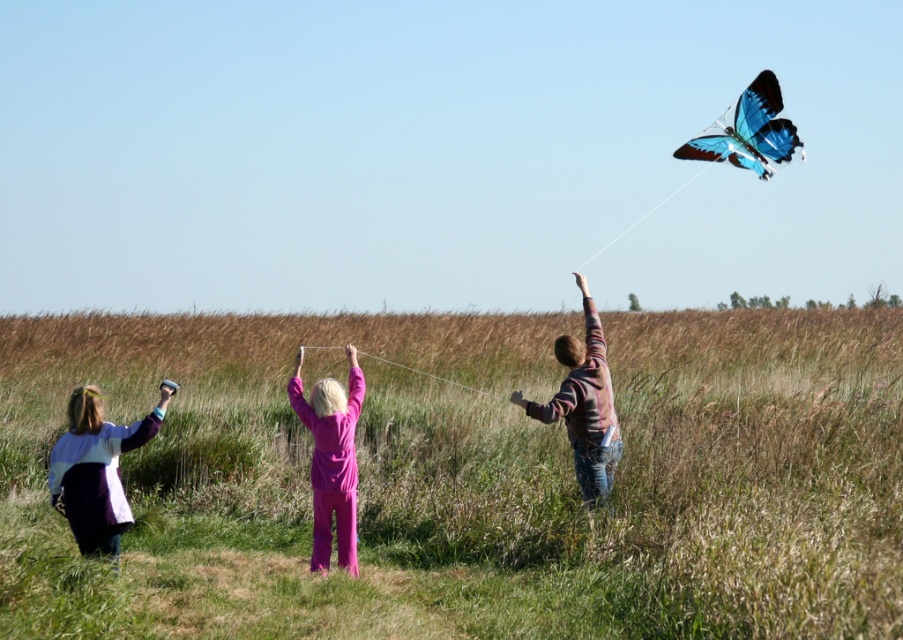
Question: Is green grass at center behind white string at center?

Choices:
 (A) yes
 (B) no

Answer: (B)

Question: Among these objects, which one is farthest from the camera?

Choices:
 (A) white cotton shirt at lower left
 (B) white string at center
 (C) purple matte pants at center

Answer: (B)

Question: Is purple matte pants at center thinner than blue glossy butterfly at upper right?

Choices:
 (A) yes
 (B) no

Answer: (A)

Question: Among these points, which one is nearest to the camera?

Choices:
 (A) (561, 401)
 (B) (798, 138)
 (C) (54, 472)
 (D) (321, 472)

Answer: (C)

Question: In this image, where is white cotton shirt at lower left located relative to blue glossy butterfly at upper right?

Choices:
 (A) below
 (B) above

Answer: (A)

Question: Which point is farther to the camera?

Choices:
 (A) (110, 492)
 (B) (771, 609)
 (C) (461, 385)

Answer: (C)